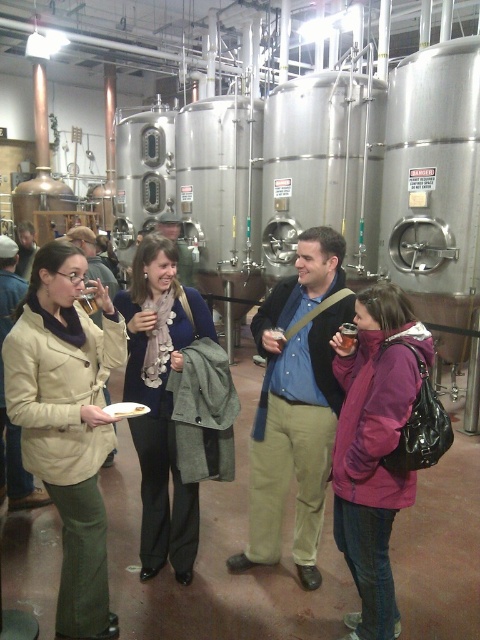
You are organizing a photo shoot in this brewery scene and need to ensure that the matte blue scarf at center and the purple fleece jacket at center are visible in the frame. Given their sizes, which item might require more careful positioning to ensure it doesn not get obscured?

The matte blue scarf at center is larger in size than the purple fleece jacket at center, so it might require more careful positioning to ensure it doesn not get obscured.

You are a guest at the event and want to retrieve your belongings from the coat check located near the entrance. You remember placing your matte beige coat at left and matte blue scarf at center. Based on their positions, which item would you need to reach first if you are standing in front of them?

The matte beige coat at left is located below the matte blue scarf at center, so you would need to reach the matte blue scarf at center first before accessing the matte beige coat at left.

You are standing at the entrance of the brewery and notice a matte blue scarf at center. If you walk straight ahead, will the scarf be in your path?

The matte blue scarf at center is located at point (175, 404), which is directly in front of you. Therefore, walking straight ahead will place the scarf in your path.